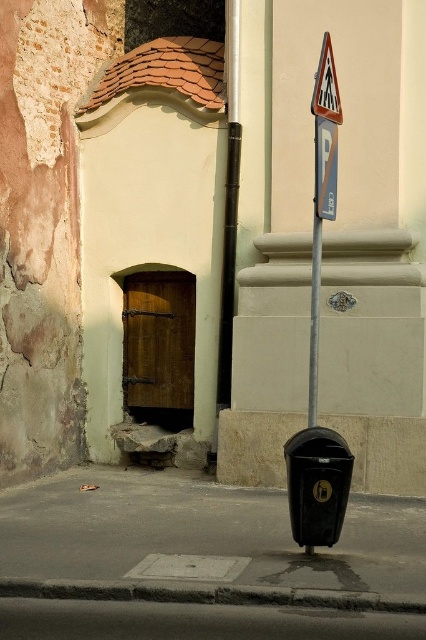
You are a delivery driver approaching the street corner and need to park your van. The van requires a parking spot that is behind the gray concrete curb at lower center. Is the metallic parking sign at center in a position that would block your parking? Please explain your reasoning.

The gray concrete curb at lower center is located below the metallic parking sign at center, so the sign is positioned above the curb. Since the van needs to park behind the curb, the metallic parking sign at center would not block the parking spot as it is above and not in the path of the vehicle.

You are a delivery person trying to park your bike between the black plastic parking meter at lower center and the metallic parking sign at center. The bike is 1.2 meters wide. Can you fit your bike between them?

The black plastic parking meter at lower center is wider than the metallic parking sign at center. Since the bike is 1.2 meters wide, you need to check the distance between them. However, the description only states the width comparison between the objects, not the distance between them. Therefore, it is unclear if the bike will fit.

You are standing at the street corner and see the building with exposed brickwork on the left and the arched doorway with a wooden door. There is a point labeled at coordinates [316,484]. What object is located at that point?

The point at coordinates [316,484] corresponds to the black plastic parking meter at lower center.